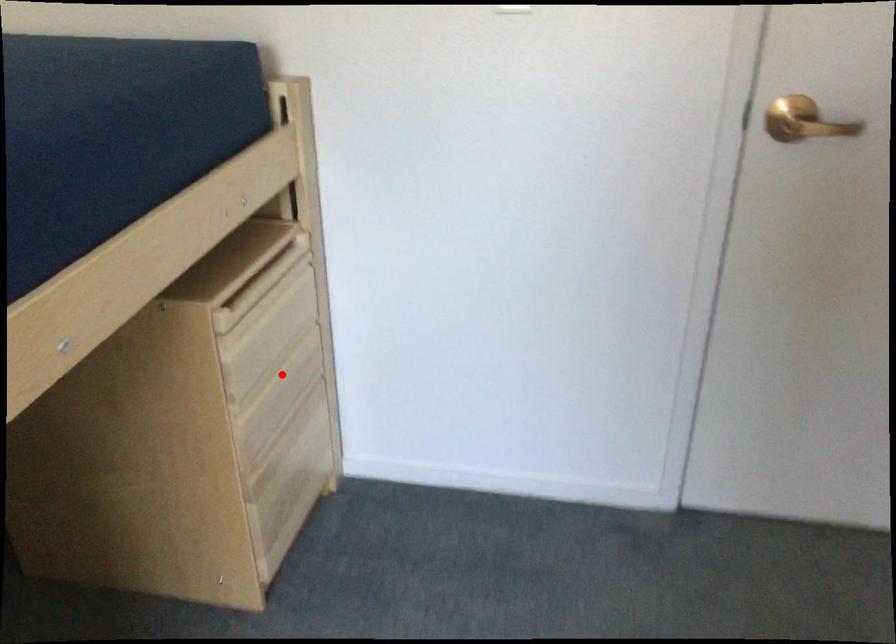
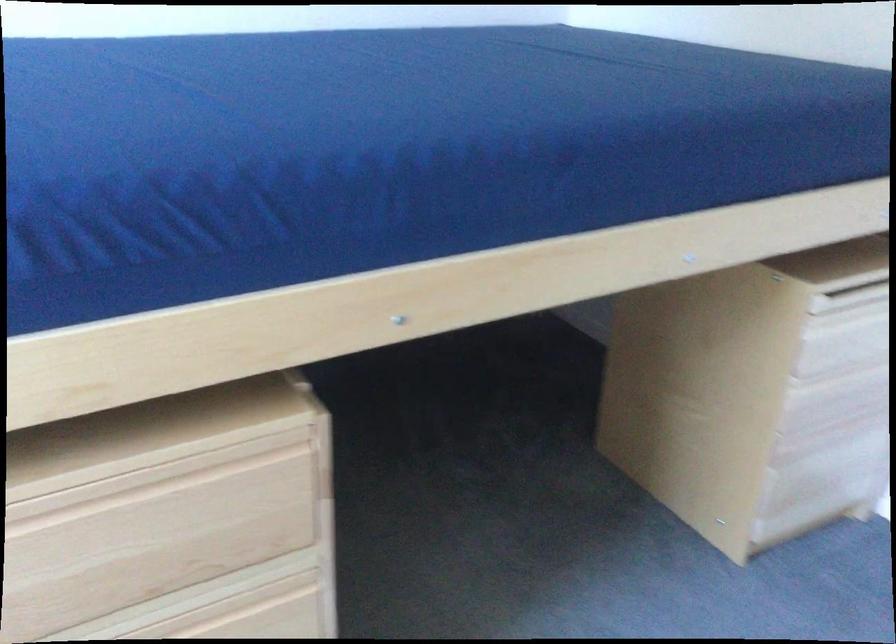
In the second image, find the point that corresponds to the highlighted location in the first image.

(845, 381)